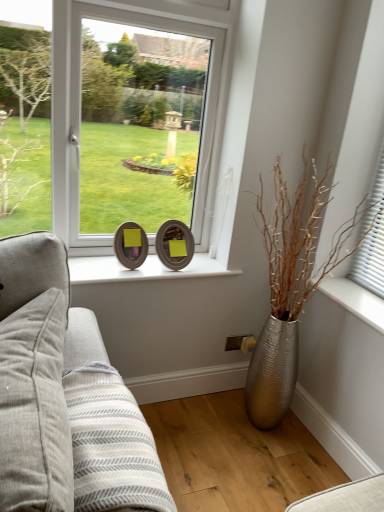
Question: Can you confirm if gray fabric pillow at left is positioned to the right of silver metallic vase at right?

Choices:
 (A) yes
 (B) no

Answer: (B)

Question: Can you confirm if gray fabric pillow at left is shorter than silver metallic vase at right?

Choices:
 (A) yes
 (B) no

Answer: (B)

Question: Is gray fabric pillow at left facing away from silver metallic vase at right?

Choices:
 (A) yes
 (B) no

Answer: (A)

Question: Is silver metallic vase at right inside gray fabric pillow at left?

Choices:
 (A) no
 (B) yes

Answer: (A)

Question: Is gray fabric pillow at left at the left side of silver metallic vase at right?

Choices:
 (A) yes
 (B) no

Answer: (A)

Question: Considering the positions of wooden oval frame at center, placed as the 1th picture frame when sorted from left to right, and wooden frame at center, which ranks as the second picture frame in left-to-right order, in the image, is wooden oval frame at center, placed as the 1th picture frame when sorted from left to right, bigger or smaller than wooden frame at center, which ranks as the second picture frame in left-to-right order,?

Choices:
 (A) small
 (B) big

Answer: (A)

Question: Is wooden oval frame at center, placed as the 1th picture frame when sorted from left to right, inside the boundaries of wooden frame at center, which is counted as the first picture frame, starting from the right, or outside?

Choices:
 (A) outside
 (B) inside

Answer: (A)

Question: Visually, is wooden oval frame at center, arranged as the second picture frame when viewed from the right, positioned to the left or to the right of wooden frame at center, which ranks as the second picture frame in left-to-right order?

Choices:
 (A) right
 (B) left

Answer: (B)

Question: In terms of height, does wooden oval frame at center, placed as the 1th picture frame when sorted from left to right, look taller or shorter compared to wooden frame at center, which is counted as the first picture frame, starting from the right?

Choices:
 (A) short
 (B) tall

Answer: (A)

Question: Based on their positions, is silver metallic vase at right located to the left or right of wooden frame at center, which ranks as the second picture frame in left-to-right order?

Choices:
 (A) left
 (B) right

Answer: (B)

Question: From their relative heights in the image, would you say silver metallic vase at right is taller or shorter than wooden frame at center, which is counted as the first picture frame, starting from the right?

Choices:
 (A) tall
 (B) short

Answer: (A)

Question: From the image's perspective, is silver metallic vase at right located above or below wooden frame at center, which ranks as the second picture frame in left-to-right order?

Choices:
 (A) below
 (B) above

Answer: (A)

Question: Is silver metallic vase at right wider or thinner than wooden frame at center, which is counted as the first picture frame, starting from the right?

Choices:
 (A) wide
 (B) thin

Answer: (A)

Question: From the image's perspective, relative to wooden oval frame at center, placed as the 1th picture frame when sorted from left to right, is silver metallic vase at right above or below?

Choices:
 (A) above
 (B) below

Answer: (B)

Question: Considering the positions of silver metallic vase at right and wooden oval frame at center, arranged as the second picture frame when viewed from the right, in the image, is silver metallic vase at right taller or shorter than wooden oval frame at center, arranged as the second picture frame when viewed from the right,?

Choices:
 (A) tall
 (B) short

Answer: (B)